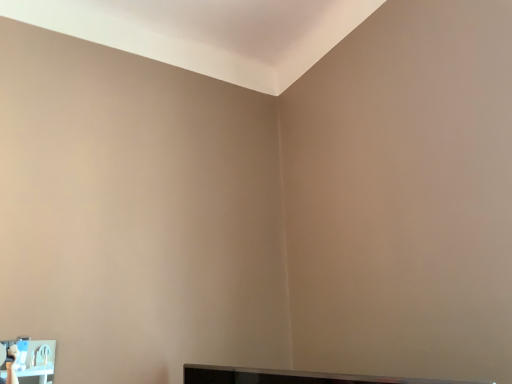
Identify the location of flat screen tv at bottom. This screenshot has width=512, height=384. (290, 377).

The height and width of the screenshot is (384, 512). Describe the element at coordinates (290, 377) in the screenshot. I see `flat screen tv at bottom` at that location.

Find the location of a particular element. flat screen tv at bottom is located at coordinates (290, 377).